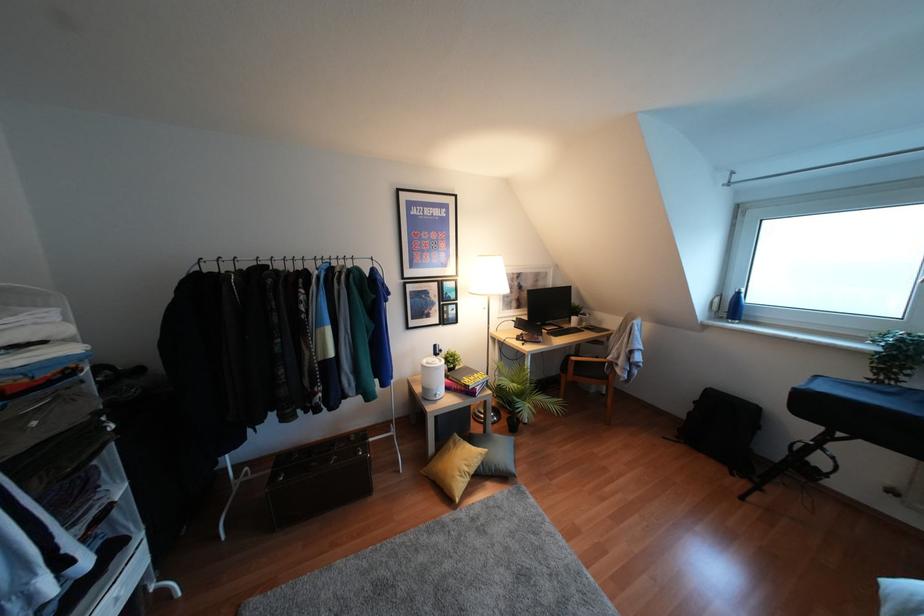
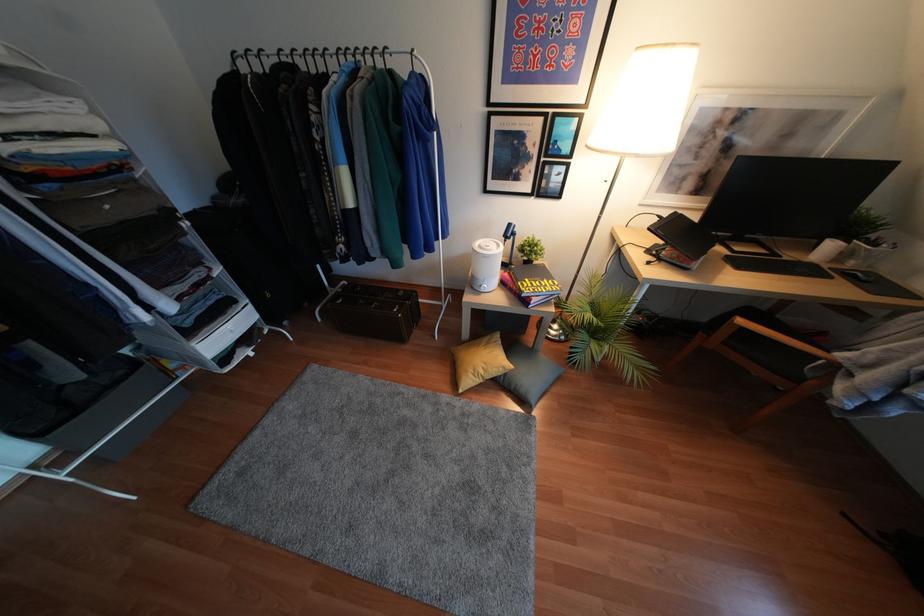
Locate, in the second image, the point that corresponds to point (446, 516) in the first image.

(445, 397)